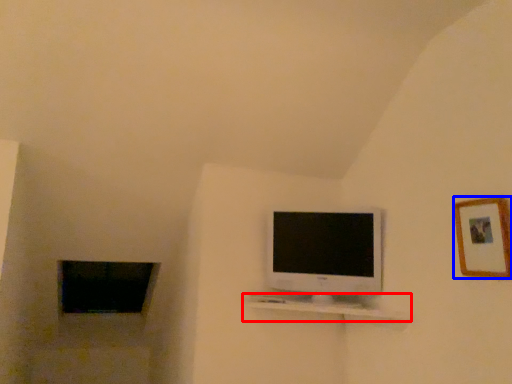
Question: Which point is closer to the camera, shelf (highlighted by a red box) or picture frame (highlighted by a blue box)?

Choices:
 (A) shelf
 (B) picture frame

Answer: (B)